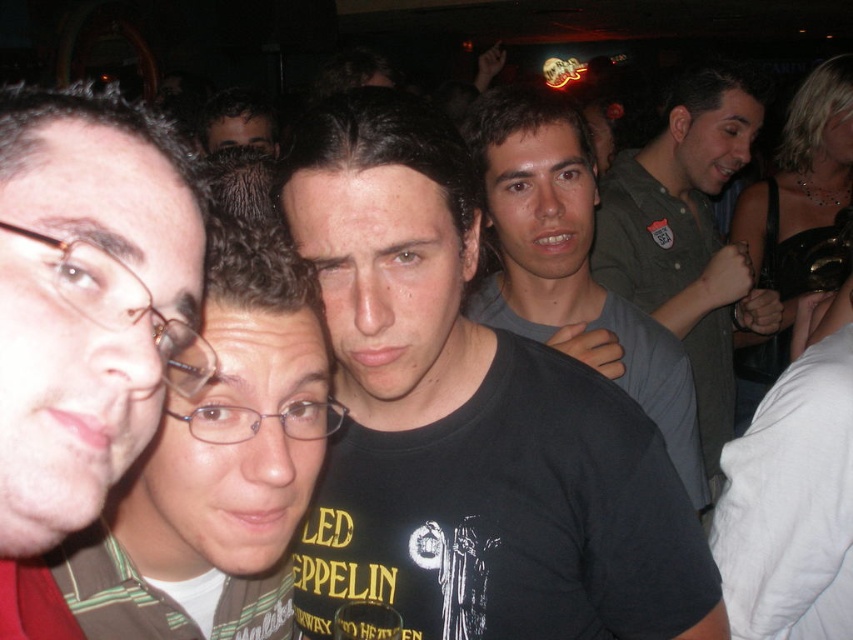
You are standing in the bar scene and want to move from point A to point B. Point A is at coordinate point(488,104) and point B is at coordinate point(677,248). Which point is closer to you?

Point(488,104) is closer to the viewer than point(677,248).

You are taking a photo of the scene and want to focus on the person in the center wearing the LED ZEPPELIN shirt. There are two points in the image at coordinates point (466, 195) and point (679, 161). Which point should you focus on to ensure the person in the center is in sharp focus?

Point (466, 195) is closer to the camera than point (679, 161), so focusing on point (466, 195) will ensure the person in the center wearing the LED ZEPPELIN shirt is in sharp focus.

You are taking a photo of the scene and want to focus on both the point at [642,476] and the point at [65,509]. Which point should you focus on first to ensure both are in sharp focus?

You should focus on the point at [642,476] first because it is closer to the camera than the point at [65,509], ensuring both will be in focus when using depth of field appropriately.